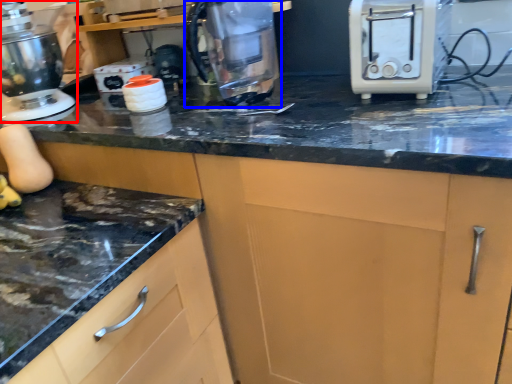
Question: Which point is closer to the camera, home appliance (highlighted by a red box) or kitchen appliance (highlighted by a blue box)?

Choices:
 (A) home appliance
 (B) kitchen appliance

Answer: (B)